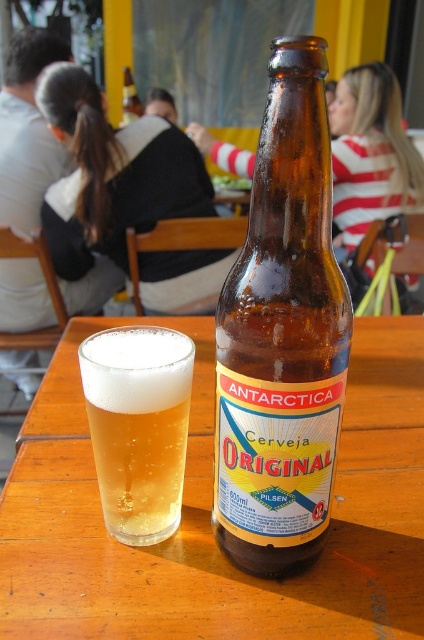
Question: Can you confirm if brown glass bottle at center is positioned to the right of brown glass bottle at upper center?

Choices:
 (A) yes
 (B) no

Answer: (A)

Question: Which object is farther from the camera taking this photo?

Choices:
 (A) brown glass bottle at upper center
 (B) clear glass beer at center

Answer: (A)

Question: Can you confirm if brown glass bottle at center is wider than clear glass beer at center?

Choices:
 (A) yes
 (B) no

Answer: (A)

Question: Among these points, which one is nearest to the camera?

Choices:
 (A) pos(109,410)
 (B) pos(300,422)
 (C) pos(125,77)
 (D) pos(198,442)

Answer: (B)

Question: Which point appears farthest from the camera in this image?

Choices:
 (A) (35, 189)
 (B) (176, 422)
 (C) (131, 113)

Answer: (C)

Question: Does wooden table at center appear under striped fabric shirt at upper center?

Choices:
 (A) no
 (B) yes

Answer: (B)